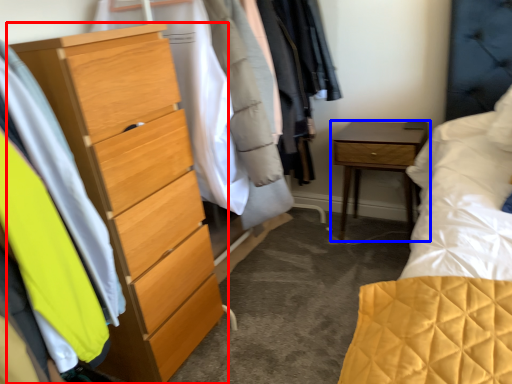
Question: Which object appears farthest to the camera in this image, chest of drawers (highlighted by a red box) or nightstand (highlighted by a blue box)?

Choices:
 (A) chest of drawers
 (B) nightstand

Answer: (B)